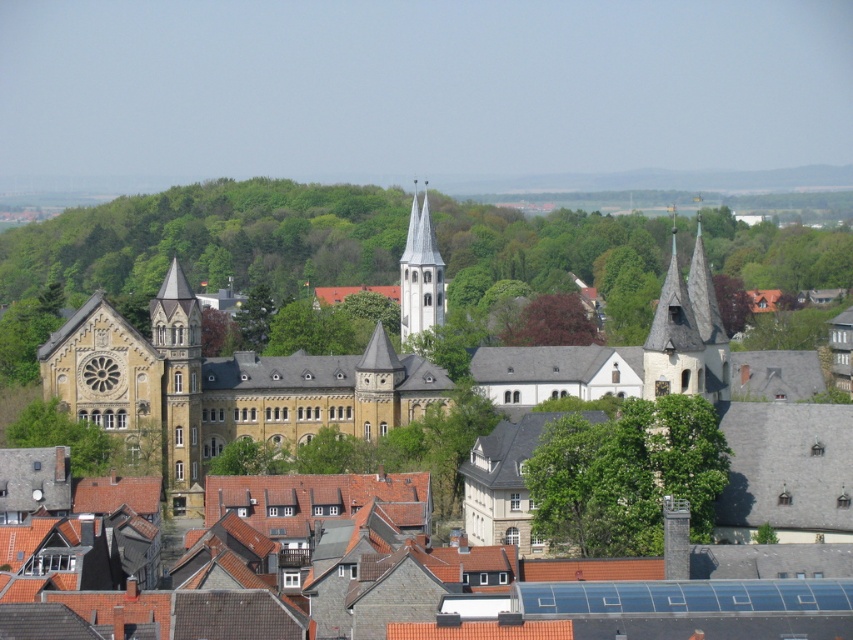
You are a tourist standing at the edge of the historic town, looking towards the golden stone church at center and the green leafy tree at center. If you want to visit both attractions, which one would you reach first if you walk directly towards them?

Answer: The golden stone church at center is 142.30 feet from the green leafy tree at center. Since you are walking towards both, you would reach the closer one first. However, without knowing your starting position relative to both, it is impossible to determine which is closer to you. Please provide more information about your location.

Based on the scene description, where is the yellow stone building at center located in the image?

The yellow stone building at center is located at point (218, 387) in the image.